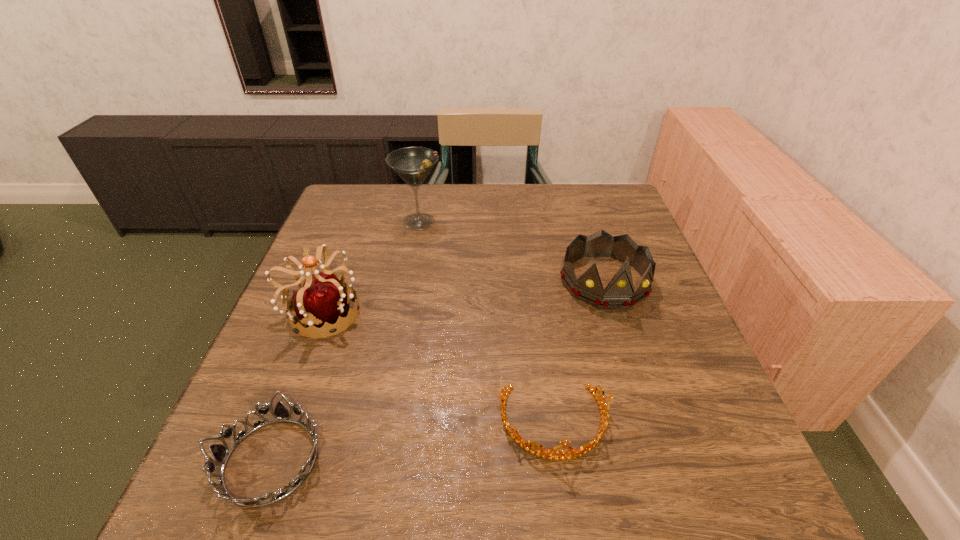
Locate an element on the screen. unoccupied position between the third tallest tiara and the shortest object is located at coordinates (412, 442).

The image size is (960, 540). In order to click on free space between the shortest object and the second shortest tiara in this screenshot , I will do `click(412, 442)`.

The height and width of the screenshot is (540, 960). What are the coordinates of `free spot between the tallest tiara and the tallest object` in the screenshot? It's located at (371, 267).

You are a GUI agent. You are given a task and a screenshot of the screen. Output one action in this format:
    pyautogui.click(x=<x>, y=<y>)
    Task: Click on the free space between the martini and the second shortest tiara
    
    Given the screenshot: What is the action you would take?
    pyautogui.click(x=487, y=322)

In order to click on vacant area that lies between the second tallest object and the third tallest tiara in this screenshot , I will do `click(438, 368)`.

Identify the location of free space that is in between the third shortest object and the shortest tiara. The height and width of the screenshot is (540, 960). (438, 371).

The width and height of the screenshot is (960, 540). What are the coordinates of `unoccupied position between the third tallest tiara and the shortest object` in the screenshot? It's located at coord(412,442).

Find the location of a particular element. unoccupied area between the third tallest object and the farthest object is located at coordinates (512, 252).

Where is `free space between the fourth shortest object and the second shortest tiara`? The image size is (960, 540). free space between the fourth shortest object and the second shortest tiara is located at coordinates (438, 368).

The image size is (960, 540). Identify the location of the closest object to the farthest object. (323, 299).